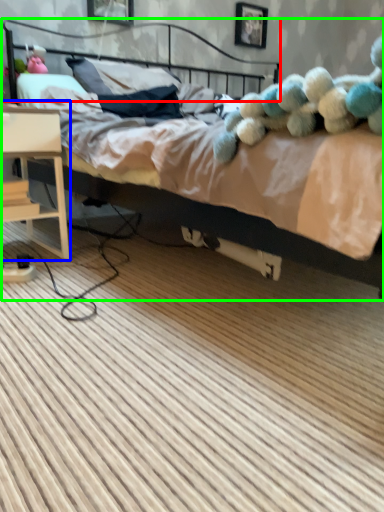
Question: Estimate the real-world distances between objects in this image. Which object is farther from headboard (highlighted by a red box), nightstand (highlighted by a blue box) or bed (highlighted by a green box)?

Choices:
 (A) nightstand
 (B) bed

Answer: (A)